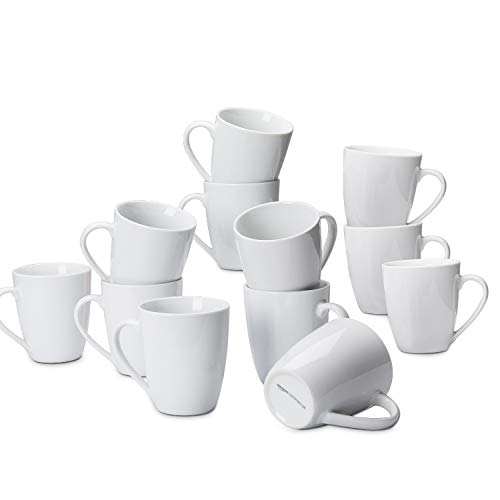
Locate an element on the screen. The width and height of the screenshot is (500, 500). bottom of mug is located at coordinates (54, 357), (189, 414), (122, 375), (293, 389), (230, 275), (369, 313), (423, 352).